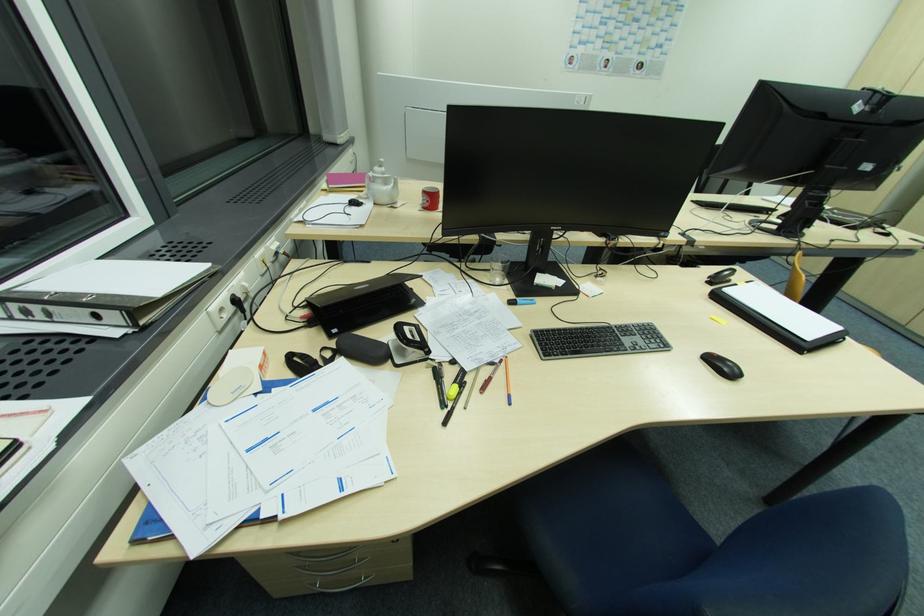
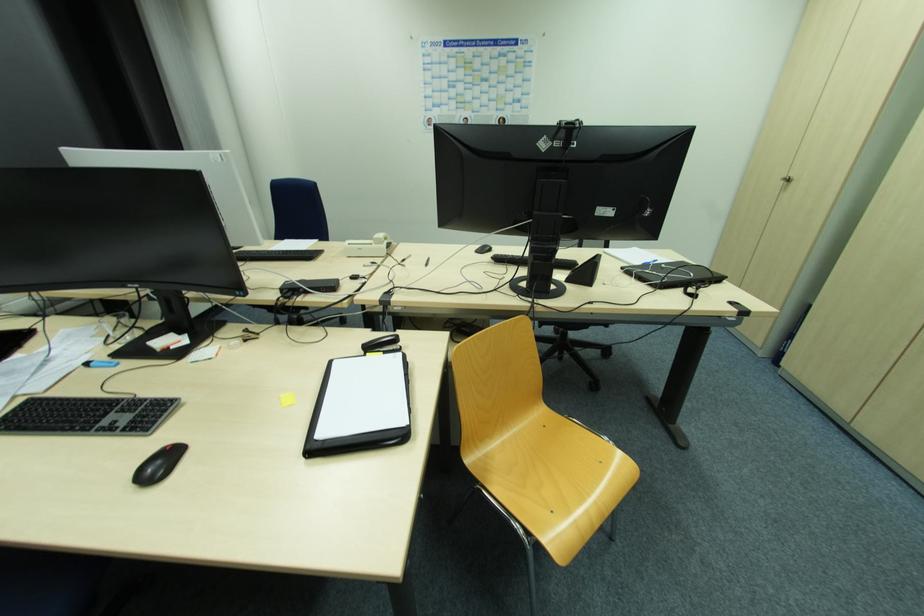
Find the pixel in the second image that matches the point at 738,286 in the first image.

(368, 357)